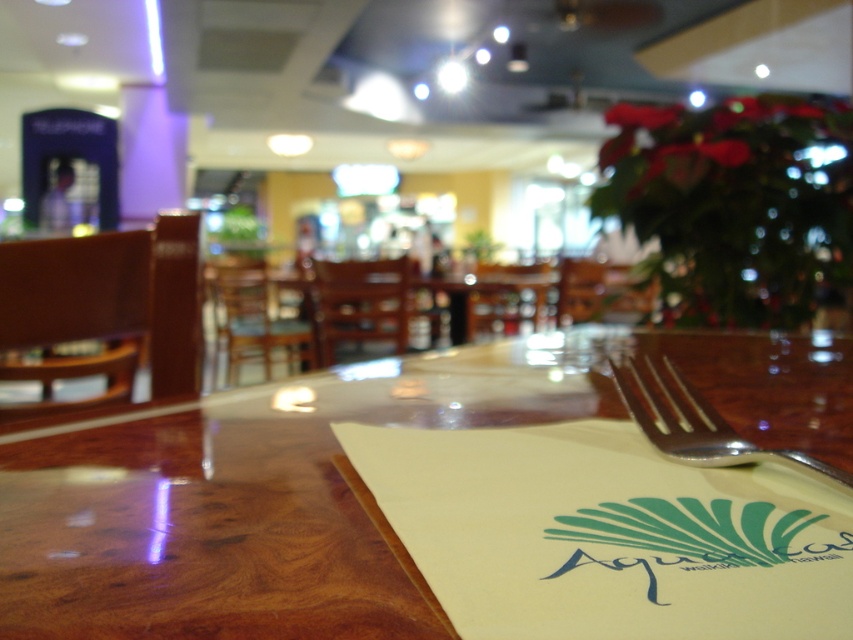
Is wooden at center shorter than silver metallic fork at lower right?

In fact, wooden at center may be taller than silver metallic fork at lower right.

Which is below, wooden at center or silver metallic fork at lower right?

wooden at center is lower down.

This screenshot has height=640, width=853. Identify the location of wooden at center. (329, 481).